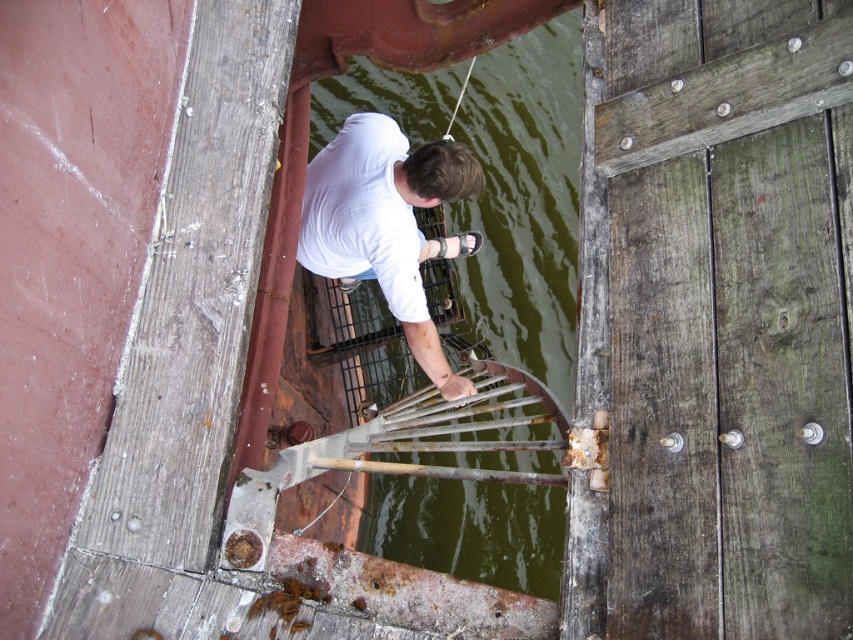
You are standing on the wooden structure and want to observe the green murky water at center. Based on its position, where exactly should you look to find it?

The green murky water at center is located at point 0.312 on the horizontal axis and 0.617 on the vertical axis, so you should look towards those coordinates to find it.

You are a photographer trying to capture the scene from the perspective of the person leaning over the metal grate. Which object, the green murky water at center or the white matte shirt at center, will appear closer to you in the photo?

The green murky water at center will appear closer to you in the photo because it is further to the viewer than the white matte shirt at center, meaning it occupies a more foreground position in the scene.

Looking at this image, you are on a wooden structure near water and want to reach a point closer to you. Which point should you head towards, point (511, 307) or point (349, 250)?

Point (511, 307) is further to the viewer than point (349, 250). Therefore, you should head towards point (349, 250) as it is closer to you.